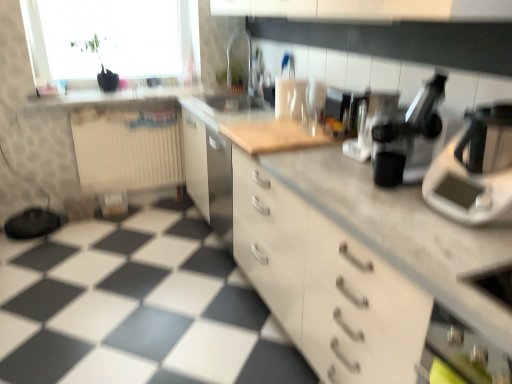
Question: In terms of height, does white matte cabinet at center look taller or shorter compared to beige ribbed radiator at left?

Choices:
 (A) tall
 (B) short

Answer: (A)

Question: Considering their positions, is white matte cabinet at center located in front of or behind beige ribbed radiator at left?

Choices:
 (A) behind
 (B) front

Answer: (B)

Question: Which object is positioned closest to the black plastic coffee machine at center, placed as the second coffee machine when sorted from back to front?

Choices:
 (A) sleek black coffee machine at center, which is counted as the first coffee machine, starting from the back
 (B) metallic silver coffee machine at upper right, which appears as the third coffee machine when viewed from the back
 (C) white plastic scale at right
 (D) transparent glass window at upper left
 (E) matte white countertop at upper center

Answer: (A)

Question: Which is farther from the matte white countertop at upper center?

Choices:
 (A) sleek black coffee machine at center, which is counted as the first coffee machine, starting from the back
 (B) metallic silver coffee machine at upper right, which appears as the third coffee machine when viewed from the back
 (C) white matte cabinet at center
 (D) transparent glass window at upper left
 (E) white plastic scale at right

Answer: (E)